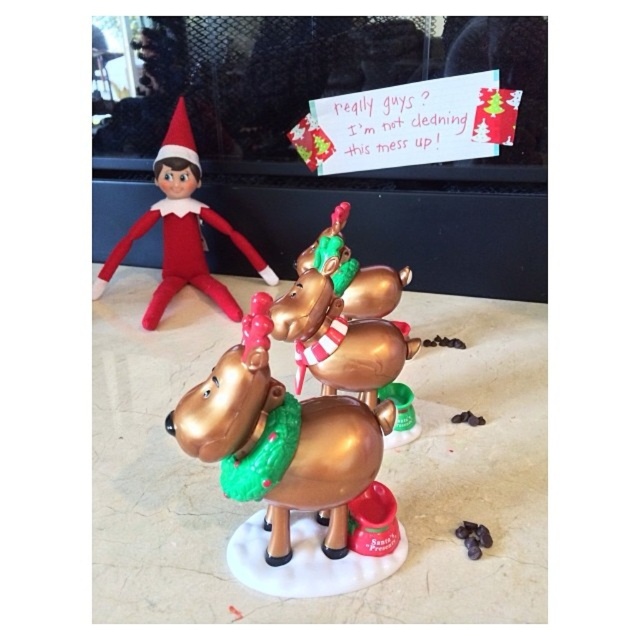
You are an observer standing in front of the festive scene. You need to locate the gold metallic reindeer at center. What are their coordinates in the image?

The gold metallic reindeer at center is located at coordinates point (282, 445).

You are a child looking for the elf in the festive scene. You see the velvety red elf at upper left and the metallic gold reindeer at center. Which object is positioned more to the left side of the image?

The velvety red elf at upper left is positioned more to the left side of the image than the metallic gold reindeer at center.

You are holding a small gift that needs to be placed exactly at the point marked by the coordinates point [253,497]. Considering the festive scene with the reindeer and elf, can you confirm if placing the gift at that point will not interfere with any of the displayed items?

The point [253,497] is 31.11 inches away from the viewer, so placing the gift there will not interfere with any displayed items as it is at a safe distance.